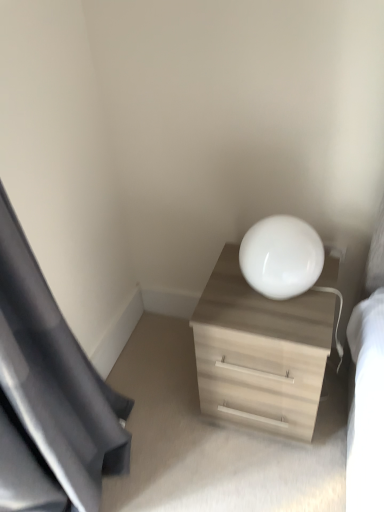
Question: From the image's perspective, is light wood dresser at center over black fabric curtain at left?

Choices:
 (A) no
 (B) yes

Answer: (A)

Question: Does light wood dresser at center have a greater width compared to black fabric curtain at left?

Choices:
 (A) no
 (B) yes

Answer: (B)

Question: Is black fabric curtain at left a part of light wood dresser at center?

Choices:
 (A) no
 (B) yes

Answer: (A)

Question: Is light wood dresser at center smaller than black fabric curtain at left?

Choices:
 (A) yes
 (B) no

Answer: (A)

Question: Is light wood dresser at center to the left of black fabric curtain at left from the viewer's perspective?

Choices:
 (A) yes
 (B) no

Answer: (B)

Question: Is white glossy lampshade at upper right inside the boundaries of light wood dresser at center, or outside?

Choices:
 (A) inside
 (B) outside

Answer: (B)

Question: In the image, is white glossy lampshade at upper right positioned in front of or behind light wood dresser at center?

Choices:
 (A) front
 (B) behind

Answer: (A)

Question: From their relative heights in the image, would you say white glossy lampshade at upper right is taller or shorter than light wood dresser at center?

Choices:
 (A) tall
 (B) short

Answer: (B)

Question: Is point (241, 246) positioned closer to the camera than point (314, 323)?

Choices:
 (A) closer
 (B) farther

Answer: (B)

Question: Looking at the image, does black fabric curtain at left seem bigger or smaller compared to white glossy lampshade at upper right?

Choices:
 (A) big
 (B) small

Answer: (A)

Question: Considering the positions of point (8, 377) and point (322, 246), is point (8, 377) closer or farther from the camera than point (322, 246)?

Choices:
 (A) farther
 (B) closer

Answer: (B)

Question: From a real-world perspective, is black fabric curtain at left above or below white glossy lampshade at upper right?

Choices:
 (A) below
 (B) above

Answer: (B)

Question: Considering the positions of black fabric curtain at left and white glossy lampshade at upper right in the image, is black fabric curtain at left taller or shorter than white glossy lampshade at upper right?

Choices:
 (A) short
 (B) tall

Answer: (B)

Question: Is point (241, 280) positioned closer to the camera than point (84, 494)?

Choices:
 (A) farther
 (B) closer

Answer: (A)

Question: From the image's perspective, is light wood dresser at center positioned above or below black fabric curtain at left?

Choices:
 (A) below
 (B) above

Answer: (A)